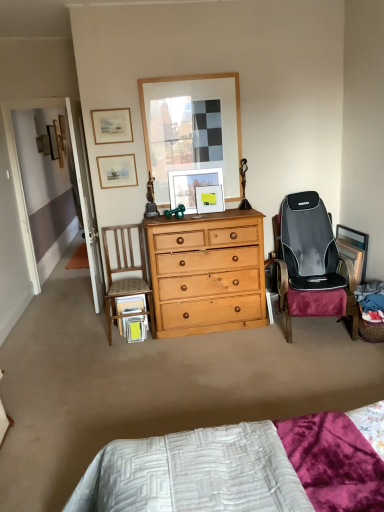
Question: Is matte wooden picture frame at upper left, which is counted as the fifth picture frame, starting from the right, far from matte wooden picture frame at center, which appears as the 5th picture frame when viewed from the top?

Choices:
 (A) yes
 (B) no

Answer: (B)

Question: Is matte wooden picture frame at upper left, which is counted as the 3th picture frame, starting from the top, to the right of matte wooden picture frame at center, which appears as the 5th picture frame when viewed from the top, from the viewer's perspective?

Choices:
 (A) yes
 (B) no

Answer: (B)

Question: Is matte wooden picture frame at center, which appears as the 5th picture frame when viewed from the top, located within matte wooden picture frame at upper left, acting as the 6th picture frame starting from the back?

Choices:
 (A) yes
 (B) no

Answer: (B)

Question: Is matte wooden picture frame at upper left, placed as the 2th picture frame when sorted from front to back, completely or partially outside of matte wooden picture frame at center, marked as the third picture frame in a bottom-to-top arrangement?

Choices:
 (A) no
 (B) yes

Answer: (B)

Question: Is matte wooden picture frame at upper left, which appears as the 3th picture frame when viewed from the left, bigger than matte wooden picture frame at center, positioned as the fourth picture frame in front-to-back order?

Choices:
 (A) yes
 (B) no

Answer: (B)

Question: Relative to matte wooden picture frame at upper left, placed as the 2th picture frame when sorted from front to back, is wooden picture frame at upper left, which is the second picture frame in left-to-right order, in front or behind?

Choices:
 (A) front
 (B) behind

Answer: (B)

Question: From the image's perspective, is wooden picture frame at upper left, which is the second picture frame in left-to-right order, above or below matte wooden picture frame at upper left, which is counted as the fifth picture frame, starting from the right?

Choices:
 (A) below
 (B) above

Answer: (B)

Question: Looking at the image, does wooden picture frame at upper left, the 6th picture frame when ordered from front to back, seem bigger or smaller compared to matte wooden picture frame at upper left, the 5th picture frame positioned from the bottom?

Choices:
 (A) small
 (B) big

Answer: (B)

Question: Would you say wooden picture frame at upper left, which is the second picture frame in left-to-right order, is inside or outside matte wooden picture frame at upper left, which is counted as the fifth picture frame, starting from the right?

Choices:
 (A) inside
 (B) outside

Answer: (B)

Question: Is matte wooden picture frame at upper left, acting as the fifth picture frame starting from the back, taller or shorter than wooden picture frame at upper left, the 6th picture frame from the right?

Choices:
 (A) tall
 (B) short

Answer: (B)

Question: In the image, is matte wooden picture frame at upper left, acting as the fourth picture frame starting from the right, positioned in front of or behind wooden picture frame at upper left, the 6th picture frame when ordered from front to back?

Choices:
 (A) front
 (B) behind

Answer: (A)

Question: Is matte wooden picture frame at upper left, arranged as the fourth picture frame when viewed from the left, spatially inside wooden picture frame at upper left, the 2th picture frame from the top, or outside of it?

Choices:
 (A) outside
 (B) inside

Answer: (A)

Question: Is matte wooden picture frame at upper left, the third picture frame from the front, bigger or smaller than wooden picture frame at upper left, the 6th picture frame when ordered from front to back?

Choices:
 (A) big
 (B) small

Answer: (B)

Question: Choose the correct answer: Is matte wooden picture frame at upper left, the third picture frame from the front, inside matte wooden picture frame at upper left, which appears as the 3th picture frame when viewed from the left, or outside it?

Choices:
 (A) inside
 (B) outside

Answer: (B)

Question: Considering the relative positions of matte wooden picture frame at upper left, acting as the fifth picture frame starting from the back, and matte wooden picture frame at upper left, which is counted as the 3th picture frame, starting from the top, in the image provided, is matte wooden picture frame at upper left, acting as the fifth picture frame starting from the back, to the left or to the right of matte wooden picture frame at upper left, which is counted as the 3th picture frame, starting from the top,?

Choices:
 (A) right
 (B) left

Answer: (A)